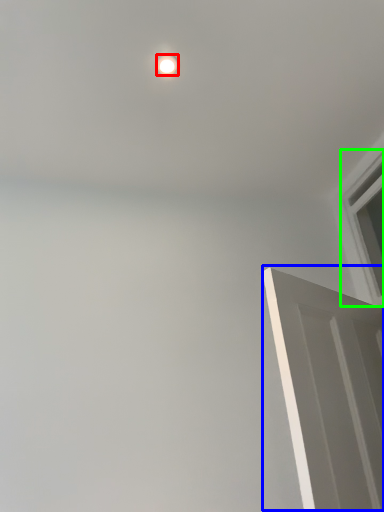
Question: Which is nearer to the lighting (highlighted by a red box)? door (highlighted by a blue box) or window (highlighted by a green box).

Choices:
 (A) door
 (B) window

Answer: (A)